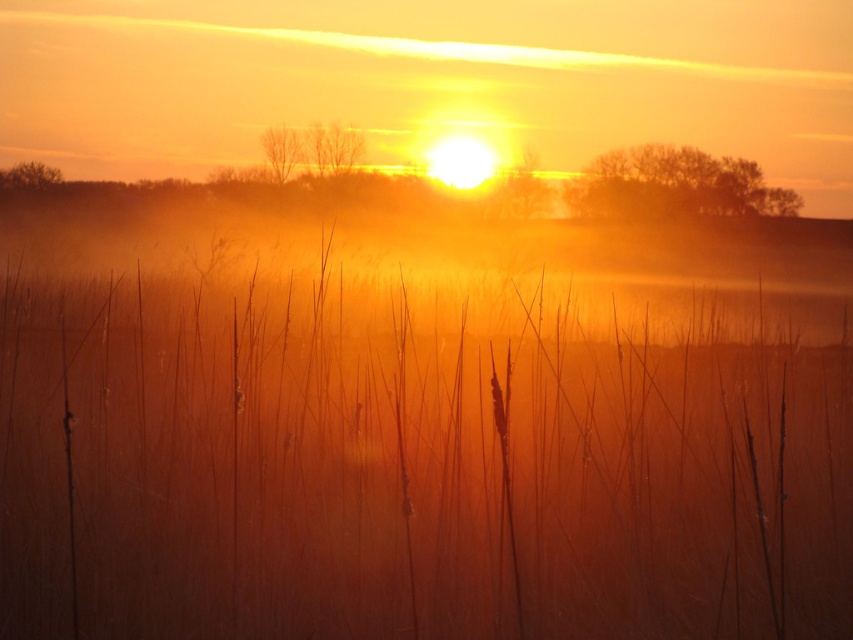
You are an artist trying to capture the sunrise or sunset scene. You want to paint the foggy mist at center. Where exactly should you place it in your canvas?

The foggy mist at center should be placed at point coordinates of (428, 81) on the canvas.

You are an artist trying to paint the sunrise scene. You notice the foggy mist at center and the bare branches at center. Which one do you think will require more space on your canvas to accurately depict their size?

The foggy mist at center is bigger than the bare branches at center, so you will need more space on your canvas to accurately depict the foggy mist at center.

You are an artist trying to paint the scene. You want to place the foggy mist at center and the bare branches at center in your painting. According to the scene, which object should be drawn first to ensure proper layering?

The bare branches at center should be drawn first because the foggy mist at center is to the right of them, meaning the branches are in front and need to be layered underneath the mist.